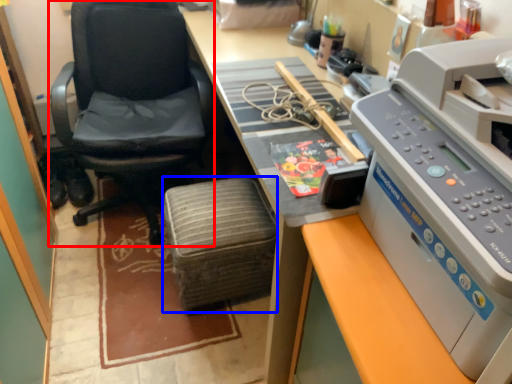
Question: Which object is closer to the camera taking this photo, chair (highlighted by a red box) or stool (highlighted by a blue box)?

Choices:
 (A) chair
 (B) stool

Answer: (A)